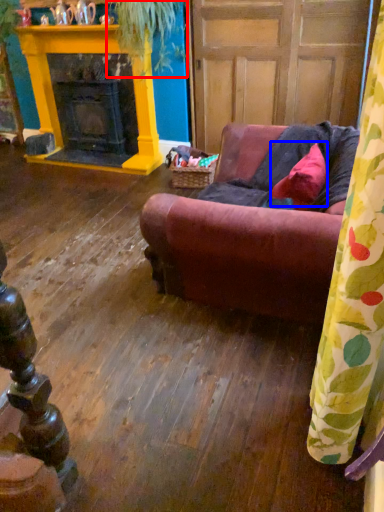
Question: Which of the following is the farthest to the observer, plant (highlighted by a red box) or pillow (highlighted by a blue box)?

Choices:
 (A) plant
 (B) pillow

Answer: (A)